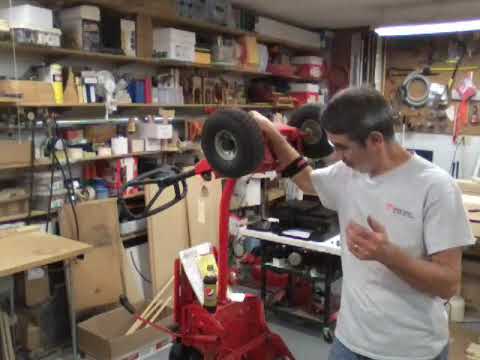
At what (x,y) coordinates should I click in order to perform the action: click on box. Please return your answer as a coordinate pair (x, y). Looking at the image, I should click on (155, 129).